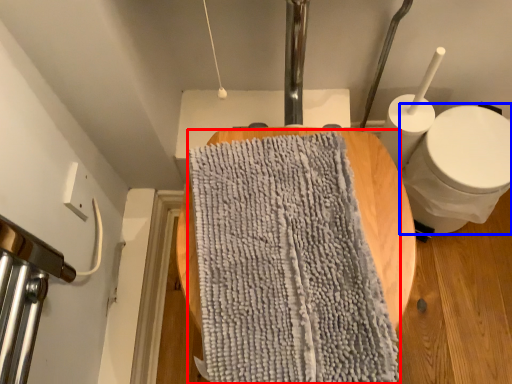
Question: Which point is closer to the camera, bath towel (highlighted by a red box) or toilet (highlighted by a blue box)?

Choices:
 (A) bath towel
 (B) toilet

Answer: (A)